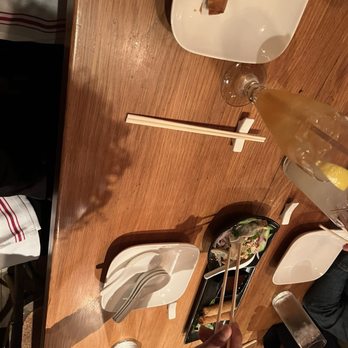
Locate an element on the screen. The height and width of the screenshot is (348, 348). drink glass is located at coordinates (242, 28), (185, 272), (313, 247), (286, 113), (299, 326).